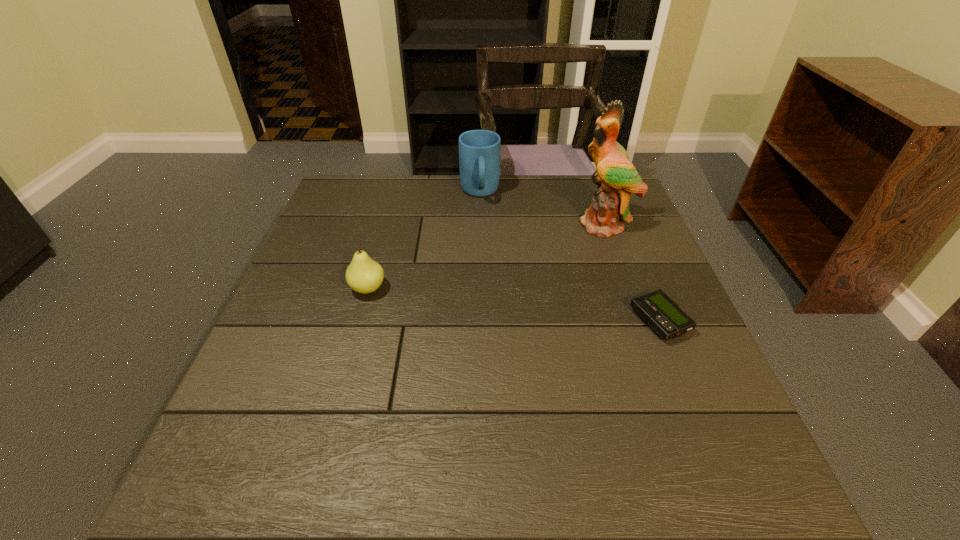
The height and width of the screenshot is (540, 960). Find the location of `free space on the desktop that is between the second shortest object and the beeper and is positioned on the side of the mug with the handle`. free space on the desktop that is between the second shortest object and the beeper and is positioned on the side of the mug with the handle is located at coordinates (493, 302).

Locate an element on the screen. This screenshot has height=540, width=960. free space on the desktop that is between the pear and the shortest object and is positioned on the front-facing side of the tallest object is located at coordinates (550, 309).